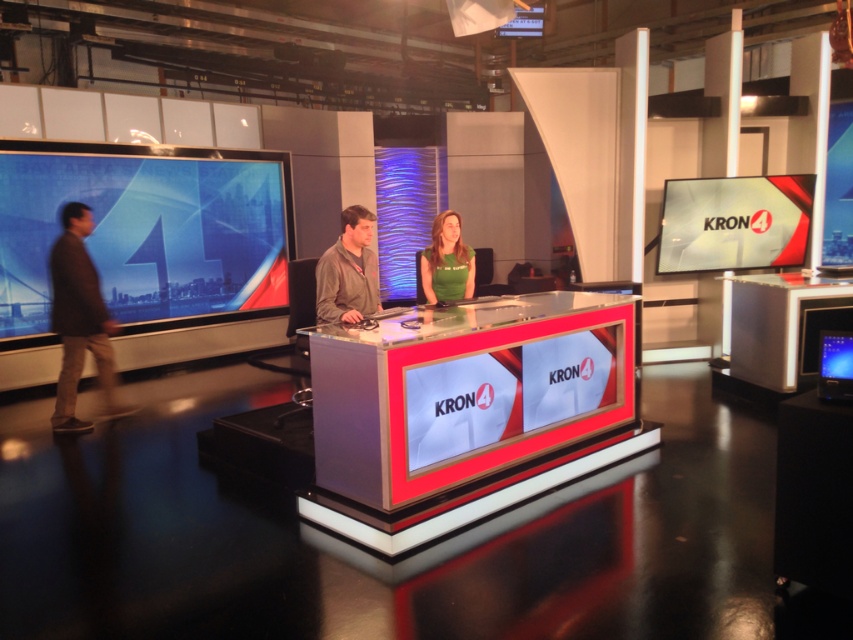
Can you confirm if brown leather jacket at left is positioned above matte gray jacket at center?

Incorrect, brown leather jacket at left is not positioned above matte gray jacket at center.

Which is in front, point (51, 273) or point (334, 244)?

Point (51, 273) is more forward.

Which is in front, point (65, 257) or point (370, 250)?

Point (370, 250)

You are a GUI agent. You are given a task and a screenshot of the screen. Output one action in this format:
    pyautogui.click(x=<x>, y=<y>)
    Task: Click on the brown leather jacket at left
    The width and height of the screenshot is (853, 640).
    Given the screenshot: What is the action you would take?
    pyautogui.click(x=79, y=320)

Does brown leather jacket at left appear under green fabric shirt at center?

Correct, brown leather jacket at left is located below green fabric shirt at center.

Between point (55, 289) and point (432, 259), which one is positioned behind?

Positioned behind is point (55, 289).

Is point (90, 317) positioned in front of point (447, 211)?

No, (90, 317) is further to viewer.

At what (x,y) coordinates should I click in order to perform the action: click on brown leather jacket at left. Please return your answer as a coordinate pair (x, y). Looking at the image, I should click on (79, 320).

Can you confirm if matte gray jacket at center is positioned below green fabric shirt at center?

Indeed, matte gray jacket at center is positioned under green fabric shirt at center.

Does matte gray jacket at center have a greater width compared to green fabric shirt at center?

Incorrect, matte gray jacket at center's width does not surpass green fabric shirt at center's.

Locate an element on the screen. The image size is (853, 640). matte gray jacket at center is located at coordinates (347, 269).